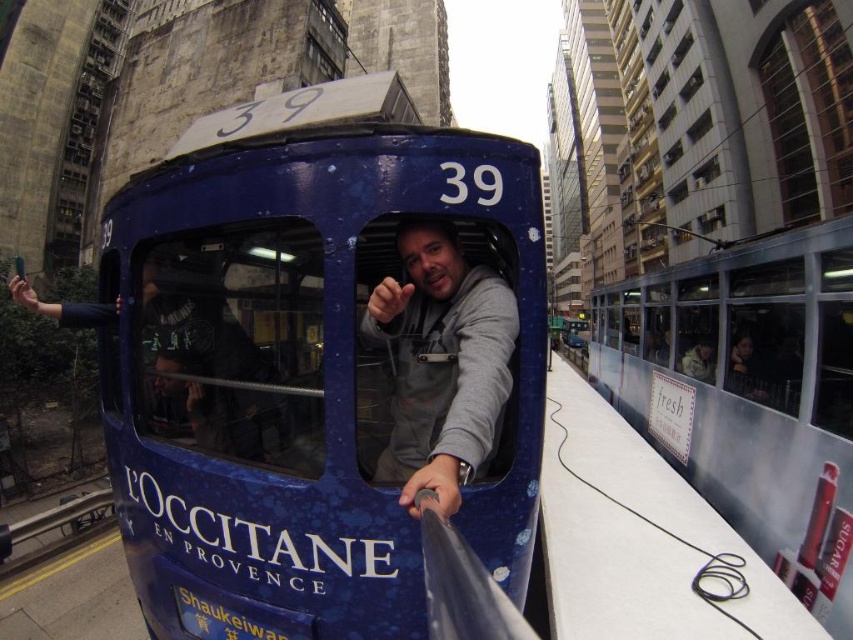
Question: Does metallic silver tram at right appear under gray fabric at center?

Choices:
 (A) yes
 (B) no

Answer: (A)

Question: Does metallic silver tram at right have a lesser width compared to gray fabric at center?

Choices:
 (A) no
 (B) yes

Answer: (A)

Question: Which point is closer to the camera?

Choices:
 (A) (463, 349)
 (B) (683, 458)

Answer: (A)

Question: Does metallic silver tram at right appear under gray fabric at center?

Choices:
 (A) no
 (B) yes

Answer: (B)

Question: Which point appears closest to the camera in this image?

Choices:
 (A) (444, 237)
 (B) (834, 579)

Answer: (A)